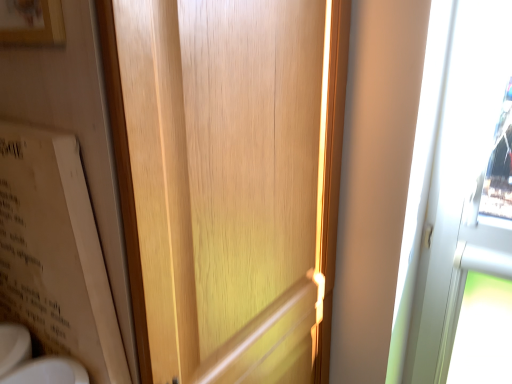
What do you see at coordinates (33, 361) in the screenshot? I see `white glossy sink at lower left` at bounding box center [33, 361].

The image size is (512, 384). What do you see at coordinates (32, 22) in the screenshot?
I see `wooden picture frame at upper left` at bounding box center [32, 22].

Identify the location of wooden door at center. This screenshot has height=384, width=512. (229, 181).

The width and height of the screenshot is (512, 384). Identify the location of beige cardboard bulletin board at left. (55, 253).

Looking at the image, does wooden picture frame at upper left seem bigger or smaller compared to beige cardboard bulletin board at left?

Considering their sizes, wooden picture frame at upper left takes up less space than beige cardboard bulletin board at left.

From the image's perspective, is wooden picture frame at upper left on top of beige cardboard bulletin board at left?

Indeed, from the image's perspective, wooden picture frame at upper left is shown above beige cardboard bulletin board at left.

Considering the relative positions of wooden picture frame at upper left and beige cardboard bulletin board at left in the image provided, is wooden picture frame at upper left to the right of beige cardboard bulletin board at left from the viewer's perspective?

Indeed, wooden picture frame at upper left is positioned on the right side of beige cardboard bulletin board at left.

Can you tell me how much wooden picture frame at upper left and beige cardboard bulletin board at left differ in facing direction?

The facing directions of wooden picture frame at upper left and beige cardboard bulletin board at left are 3.64 degrees apart.

Can you confirm if white glossy sink at lower left is positioned to the left of beige cardboard bulletin board at left?

No, white glossy sink at lower left is not to the left of beige cardboard bulletin board at left.

Considering the relative sizes of white glossy sink at lower left and beige cardboard bulletin board at left in the image provided, is white glossy sink at lower left shorter than beige cardboard bulletin board at left?

Correct, white glossy sink at lower left is not as tall as beige cardboard bulletin board at left.

Is white glossy sink at lower left facing towards beige cardboard bulletin board at left?

No, white glossy sink at lower left is not facing towards beige cardboard bulletin board at left.

From a real-world perspective, is white glossy sink at lower left physically above beige cardboard bulletin board at left?

Incorrect, from a real-world perspective, white glossy sink at lower left is lower than beige cardboard bulletin board at left.

Could you tell me if beige cardboard bulletin board at left is turned towards wooden picture frame at upper left?

No.

In the scene shown: Considering the sizes of objects beige cardboard bulletin board at left and wooden picture frame at upper left in the image provided, who is shorter, beige cardboard bulletin board at left or wooden picture frame at upper left?

With less height is wooden picture frame at upper left.

You are a GUI agent. You are given a task and a screenshot of the screen. Output one action in this format:
    pyautogui.click(x=<x>, y=<y>)
    Task: Click on the sink that appears on the left of wooden door at center
    
    Given the screenshot: What is the action you would take?
    pyautogui.click(x=33, y=361)

Between white glossy sink at lower left and wooden door at center, which one appears on the right side from the viewer's perspective?

wooden door at center.

Is white glossy sink at lower left outside of wooden door at center?

Yes, white glossy sink at lower left is outside of wooden door at center.

Between white glossy sink at lower left and wooden door at center, which one has more height?

With more height is wooden door at center.

From the image's perspective, is wooden door at center above or below white glossy sink at lower left?

wooden door at center is above white glossy sink at lower left.

Who is bigger, wooden door at center or white glossy sink at lower left?

wooden door at center.

In order to click on door in front of the white glossy sink at lower left in this screenshot , I will do `click(229, 181)`.

Find the location of a particular element. This screenshot has width=512, height=384. door on the right of wooden picture frame at upper left is located at coordinates coord(229,181).

From a real-world perspective, is wooden picture frame at upper left below wooden door at center?

No, from a real-world perspective, wooden picture frame at upper left is not below wooden door at center.

What's the angular difference between wooden picture frame at upper left and wooden door at center's facing directions?

There is a 88-degree angle between the facing directions of wooden picture frame at upper left and wooden door at center.

Would you say wooden picture frame at upper left is inside or outside wooden door at center?

wooden picture frame at upper left is located inside wooden door at center.

Consider the image. From a real-world perspective, which object rests below the other?

From a 3D spatial view, white glossy sink at lower left is below.

Locate an element on the screen. The height and width of the screenshot is (384, 512). bulletin board to the left of white glossy sink at lower left is located at coordinates (55, 253).

Consider the image. Between beige cardboard bulletin board at left and white glossy sink at lower left, which one appears on the right side from the viewer's perspective?

white glossy sink at lower left is more to the right.

Based on the photo, considering the relative positions of beige cardboard bulletin board at left and white glossy sink at lower left in the image provided, is beige cardboard bulletin board at left in front of white glossy sink at lower left?

Yes, beige cardboard bulletin board at left is closer to the viewer.

Identify the location of bulletin board below the wooden picture frame at upper left (from a real-world perspective). point(55,253).

The height and width of the screenshot is (384, 512). In order to click on bulletin board located on the left of white glossy sink at lower left in this screenshot , I will do `click(55, 253)`.

From the image, which object appears to be farther from wooden picture frame at upper left, wooden door at center or white glossy sink at lower left?

white glossy sink at lower left is further to wooden picture frame at upper left.

From the image, which object appears to be farther from wooden picture frame at upper left, beige cardboard bulletin board at left or white glossy sink at lower left?

The object further to wooden picture frame at upper left is white glossy sink at lower left.

Considering their positions, is wooden picture frame at upper left positioned further to beige cardboard bulletin board at left than wooden door at center?

Based on the image, wooden picture frame at upper left appears to be further to beige cardboard bulletin board at left.

When comparing their distances from white glossy sink at lower left, does wooden door at center or beige cardboard bulletin board at left seem closer?

Among the two, beige cardboard bulletin board at left is located nearer to white glossy sink at lower left.

From the image, which object appears to be farther from beige cardboard bulletin board at left, white glossy sink at lower left or wooden picture frame at upper left?

Based on the image, wooden picture frame at upper left appears to be further to beige cardboard bulletin board at left.

Based on their spatial positions, is wooden picture frame at upper left or white glossy sink at lower left further from wooden door at center?

white glossy sink at lower left.

When comparing their distances from wooden door at center, does beige cardboard bulletin board at left or white glossy sink at lower left seem closer?

beige cardboard bulletin board at left is closer to wooden door at center.

From the image, which object appears to be nearer to wooden picture frame at upper left, wooden door at center or beige cardboard bulletin board at left?

beige cardboard bulletin board at left.

Locate an element on the screen. The width and height of the screenshot is (512, 384). door between beige cardboard bulletin board at left and white glossy sink at lower left in the up-down direction is located at coordinates (229, 181).

The image size is (512, 384). In order to click on door between wooden picture frame at upper left and white glossy sink at lower left in the vertical direction in this screenshot , I will do `click(229, 181)`.

Image resolution: width=512 pixels, height=384 pixels. Find the location of `bulletin board between wooden picture frame at upper left and white glossy sink at lower left from top to bottom`. bulletin board between wooden picture frame at upper left and white glossy sink at lower left from top to bottom is located at coordinates (55, 253).

The height and width of the screenshot is (384, 512). Identify the location of bulletin board between wooden picture frame at upper left and wooden door at center vertically. pyautogui.click(x=55, y=253).